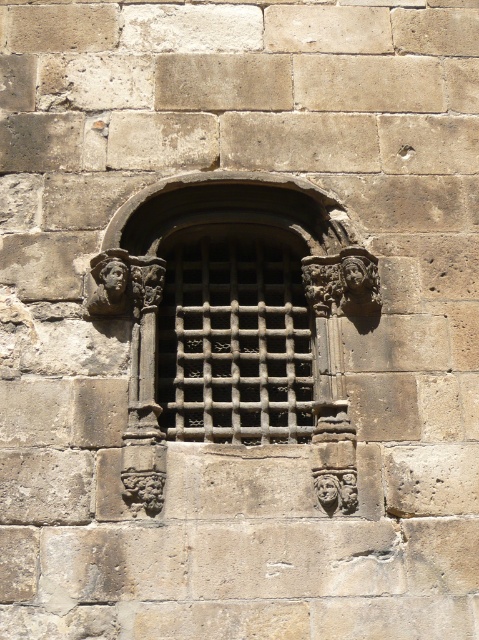
Based on the photo, you are a painter standing 2 meters away from the wooden lattice window at center and the matte stone face at left. Can you reach both objects with your 2.5 meter long paintbrush?

The wooden lattice window at center and the matte stone face at left are 1.98 meters apart. Since your paintbrush is 2.5 meters long, which is longer than the distance between them, you can reach both objects with your paintbrush.

You are standing in front of a stone wall with an arched window. There is a point at coordinates (238, 308). Based on the image, which object does this point belong to?

The point at coordinates (238, 308) is on the wooden lattice window at center.

You are an architect analyzing the stone wall. You need to determine which object occupies more space on the wall between the wooden lattice window at center and the matte stone face at left. Based on their sizes, which one would you choose?

The wooden lattice window at center is larger in size than the matte stone face at left, so it occupies more space on the wall.